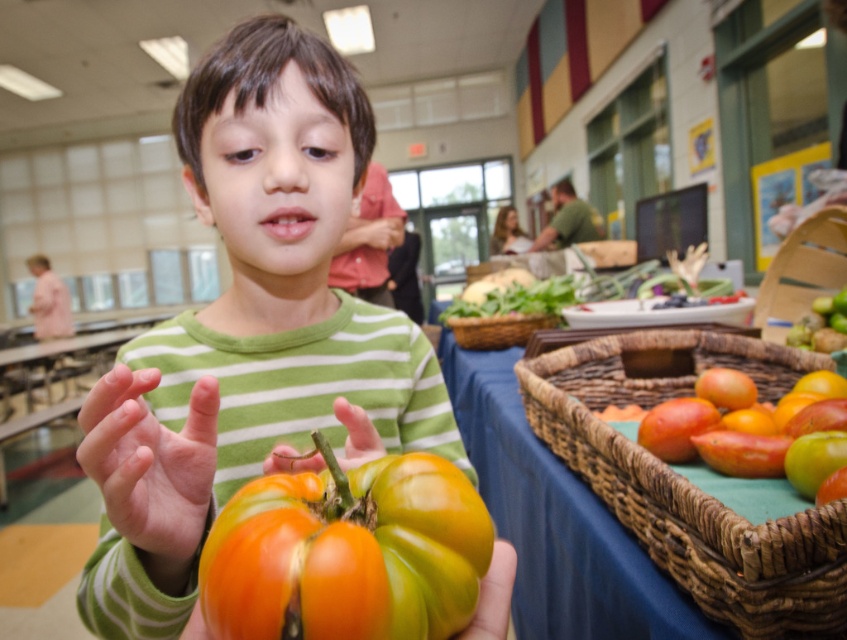
Question: Which object is farther from the camera taking this photo?

Choices:
 (A) pale skin at center
 (B) woven brown basket at lower right
 (C) brown woven basket at center
 (D) smooth green hand at center

Answer: (C)

Question: Considering the relative positions of pale skin at center and smooth green hand at center in the image provided, where is pale skin at center located with respect to smooth green hand at center?

Choices:
 (A) below
 (B) above

Answer: (B)

Question: Among these objects, which one is nearest to the camera?

Choices:
 (A) matte green shirt at center
 (B) brown woven basket at center
 (C) pale skin at center
 (D) smooth green hand at center

Answer: (A)

Question: Can you confirm if ripe orange tomato at center is positioned to the right of ripe tomato at right?

Choices:
 (A) no
 (B) yes

Answer: (A)

Question: Does matte green shirt at center appear on the left side of pale skin at center?

Choices:
 (A) no
 (B) yes

Answer: (B)

Question: Considering the real-world distances, which object is farthest from the ripe tomato at right?

Choices:
 (A) pale skin at center
 (B) matte green shirt at center
 (C) smooth green hand at center
 (D) ripe orange tomato at center

Answer: (A)